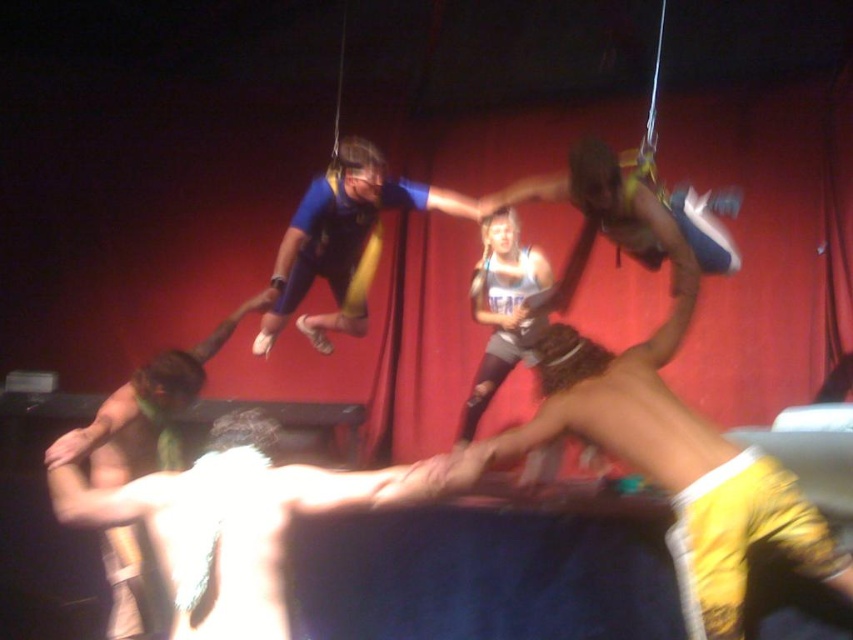
Question: Among these objects, which one is nearest to the camera?

Choices:
 (A) blue fabric at center
 (B) skinny white man at center

Answer: (B)

Question: Is skinny white man at center bigger than blue fabric at center?

Choices:
 (A) no
 (B) yes

Answer: (A)

Question: Can you confirm if skinny white man at center is bigger than blue fabric at center?

Choices:
 (A) no
 (B) yes

Answer: (A)

Question: Which object appears farthest from the camera in this image?

Choices:
 (A) skinny white man at center
 (B) blue fabric at center

Answer: (B)

Question: Observing the image, what is the correct spatial positioning of skinny white man at center in reference to blue fabric at center?

Choices:
 (A) above
 (B) below

Answer: (B)